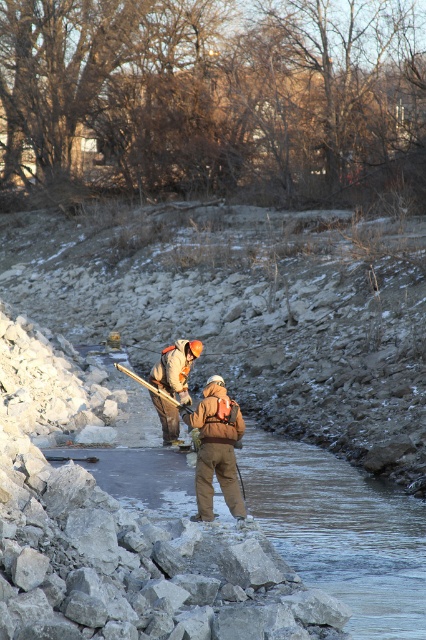
Question: Is clear ice at center further to the viewer compared to camouflage jacket at center?

Choices:
 (A) yes
 (B) no

Answer: (B)

Question: Among these objects, which one is nearest to the camera?

Choices:
 (A) camouflage jacket at center
 (B) brown fuzzy jacket at center

Answer: (B)

Question: Can you confirm if clear ice at center is thinner than brown fuzzy jacket at center?

Choices:
 (A) yes
 (B) no

Answer: (A)

Question: Which object is the farthest from the brown fuzzy jacket at center?

Choices:
 (A) camouflage jacket at center
 (B) clear ice at center

Answer: (A)

Question: Is clear ice at center wider than brown fuzzy jacket at center?

Choices:
 (A) yes
 (B) no

Answer: (B)

Question: Which point is closer to the camera taking this photo?

Choices:
 (A) (169, 355)
 (B) (132, 465)
 (C) (195, 493)

Answer: (C)